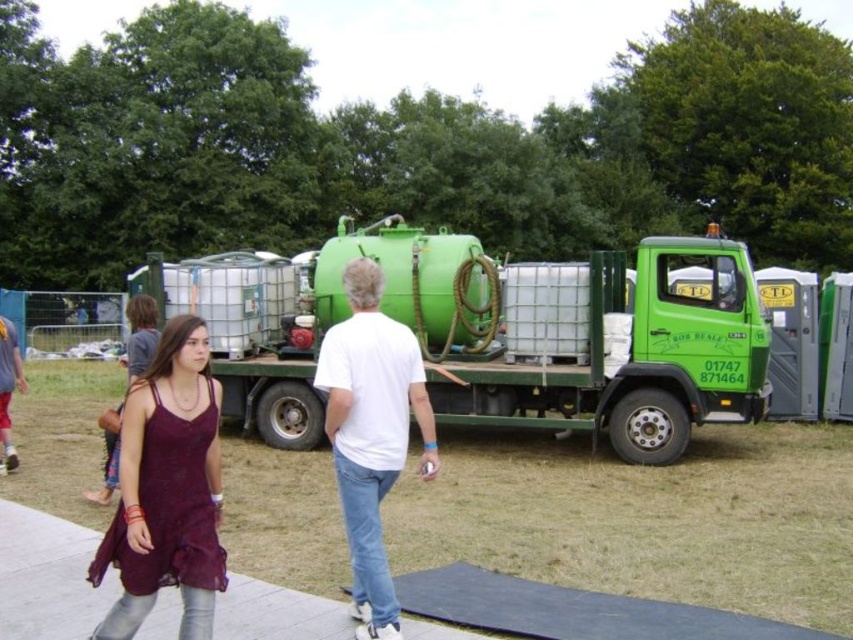
You are a delivery driver who needs to park your vehicle on the white concrete pavement at lower center. However, there is a green matte truck at center blocking the path. Can you drive forward to reach the pavement?

The white concrete pavement at lower center is behind the green matte truck at center, so you cannot drive forward to reach it because the truck is blocking the path.

Based on the photo, you are a delivery person who needs to drive under a low bridge that has a clearance of 2 meters. You are currently standing next to the green matte truck at center and the white concrete pavement at lower center. Based on their heights, can the truck pass under the bridge?

The green matte truck at center is taller than the white concrete pavement at lower center. However, the height of the pavement itself isn not provided. Without knowing the exact height of the truck, it is impossible to determine if it can pass under the 2 meter bridge.

From the picture: You are a delivery person who needs to pick up a package from the green matte truck at center and deliver it to the burgundy lace dress at center. According to the scene, which direction should you move relative to the truck to reach the dress?

The green matte truck at center is located above the burgundy lace dress at center, so you should move downward from the truck to reach the dress.